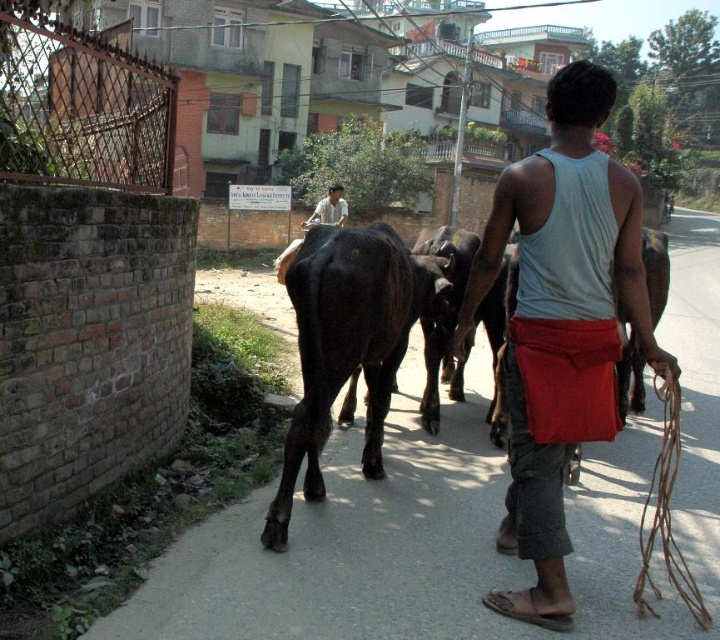
You are a photographer trying to capture the scene. You want to ensure both the gray cotton tank top at center and the black glossy bull at center are clearly visible in your shot. Considering their sizes, which one might require you to adjust your focus more carefully to ensure clarity?

The gray cotton tank top at center has a lesser width compared to the black glossy bull at center, so the smaller size of the gray cotton tank top at center may require more careful focus adjustment to ensure clarity in the photograph.

You are a photographer trying to capture the scene. You notice the black glossy bull at center and the light brown shirt at upper center. Which object appears smaller in the photo?

The black glossy bull at center appears smaller in the photo because it has a smaller size compared to the light brown shirt at upper center.